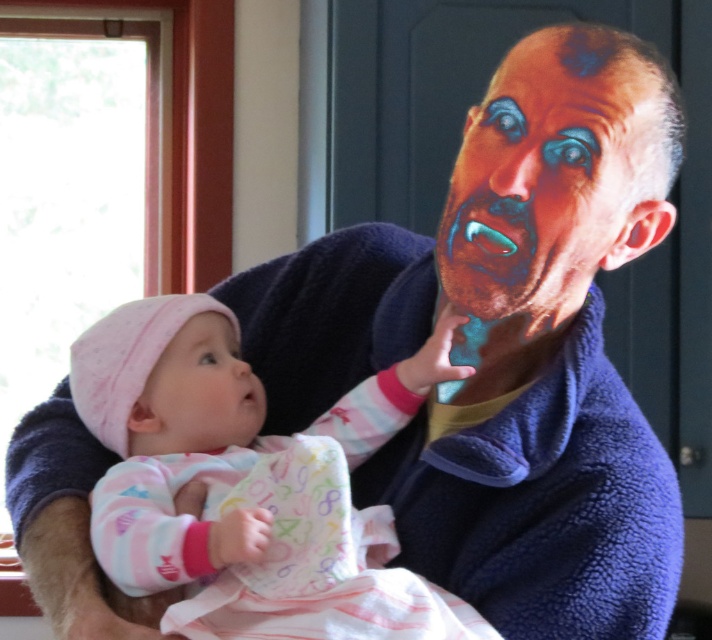
Question: Observing the image, what is the correct spatial positioning of shiny blue face at upper right in reference to smooth pink fabric at center?

Choices:
 (A) above
 (B) below

Answer: (A)

Question: Which point is closer to the camera?

Choices:
 (A) pink fleece onesie at center
 (B) smooth pink fabric at center

Answer: (A)

Question: Is pink fleece onesie at center behind shiny blue face at upper right?

Choices:
 (A) no
 (B) yes

Answer: (A)

Question: Which object is farther from the camera taking this photo?

Choices:
 (A) pink fleece onesie at center
 (B) smooth pink fabric at center
 (C) shiny blue face at upper right

Answer: (B)

Question: In this image, where is shiny blue face at upper right located relative to smooth pink fabric at center?

Choices:
 (A) left
 (B) right

Answer: (B)

Question: Which point is closer to the camera taking this photo?

Choices:
 (A) (461, 188)
 (B) (377, 509)
 (C) (167, 397)

Answer: (A)